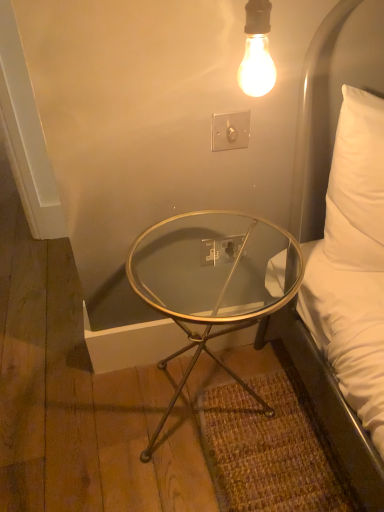
Question: Considering their positions, is clear glass table at lower center located in front of or behind white plastic outlet at center, marked as the 1th electric outlet in a back-to-front arrangement?

Choices:
 (A) behind
 (B) front

Answer: (B)

Question: Is clear glass table at lower center taller or shorter than white plastic outlet at center, which is counted as the second electric outlet, starting from the top?

Choices:
 (A) short
 (B) tall

Answer: (B)

Question: Estimate the real-world distances between objects in this image. Which object is closer to the white plastic switch at upper center, acting as the second electric outlet starting from the bottom?

Choices:
 (A) white plastic outlet at center, which is counted as the second electric outlet, starting from the top
 (B) clear glass table at lower center

Answer: (A)

Question: Estimate the real-world distances between objects in this image. Which object is closer to the clear glass table at lower center?

Choices:
 (A) white plastic outlet at center, marked as the 1th electric outlet in a back-to-front arrangement
 (B) white plastic switch at upper center, acting as the second electric outlet starting from the bottom

Answer: (A)